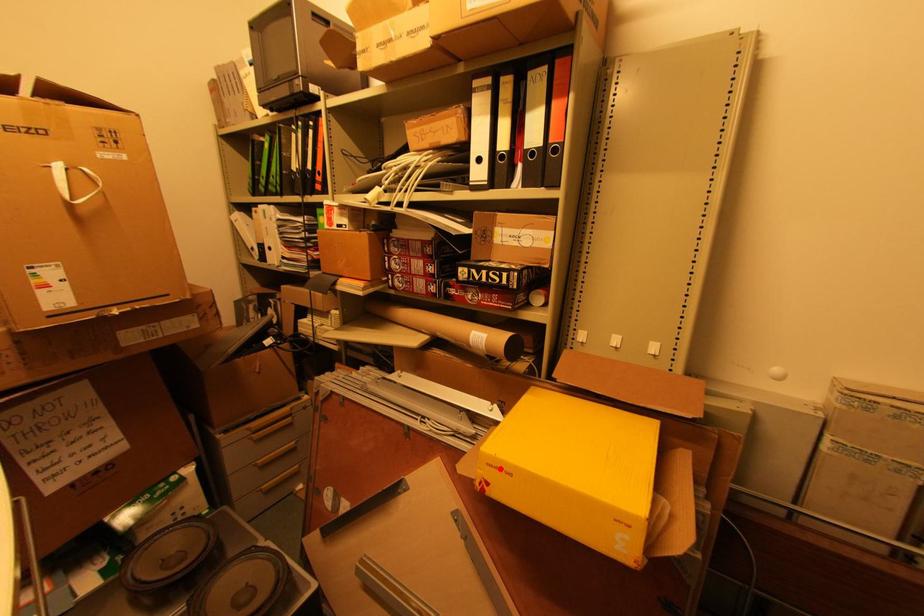
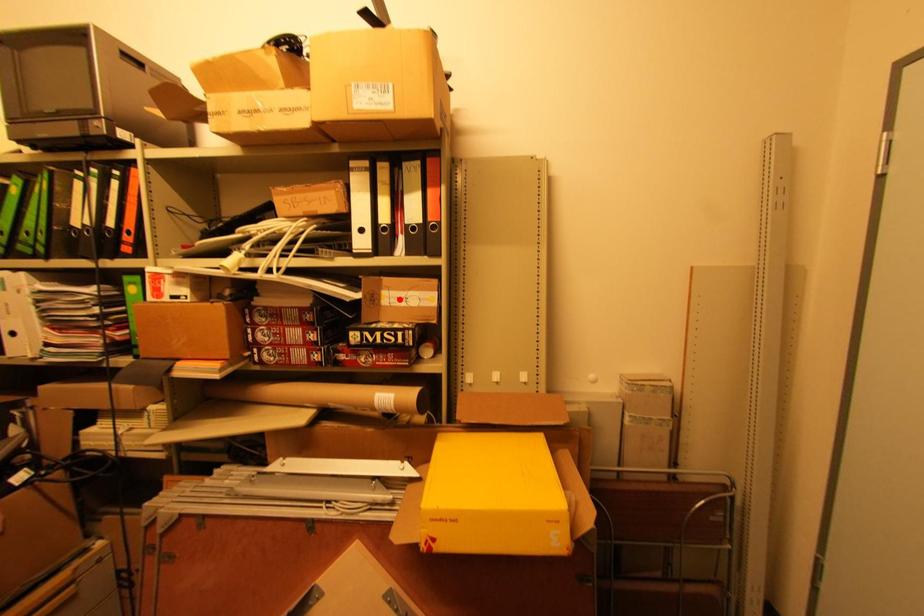
I am providing you with two images of the same scene from different viewpoints. A red point is marked on the first image and another point is marked on the second image. Do the highlighted points in image1 and image2 indicate the same real-world spot?

No